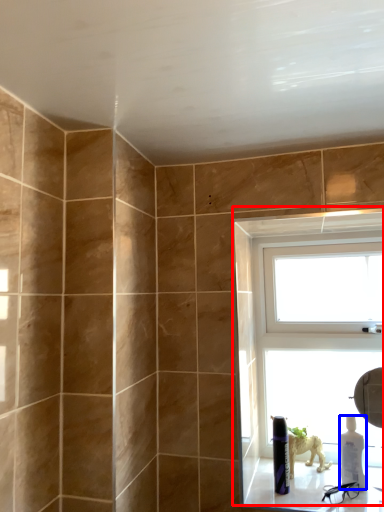
Question: Which object is further to the camera taking this photo, window (highlighted by a red box) or bottle (highlighted by a blue box)?

Choices:
 (A) window
 (B) bottle

Answer: (A)